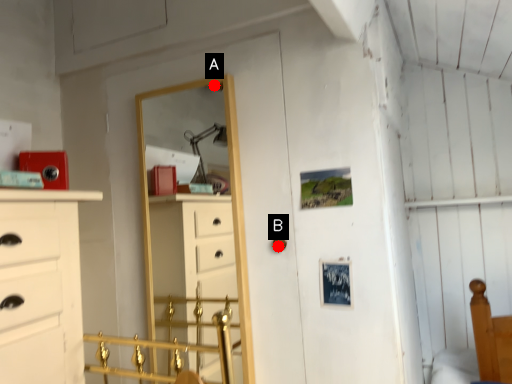
Question: Two points are circled on the image, labeled by A and B beside each circle. Which point is farther from the camera taking this photo?

Choices:
 (A) A is further
 (B) B is further

Answer: (A)